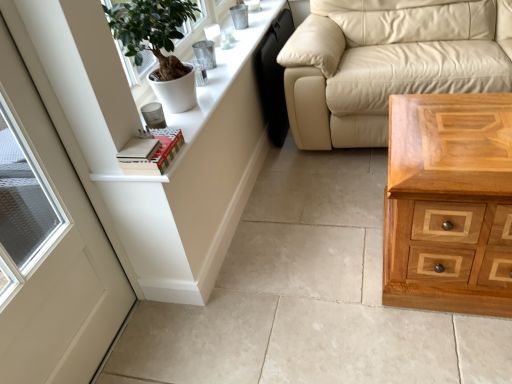
Question: Does light brown wood chest of drawers at lower right have a greater width compared to white matte door at left?

Choices:
 (A) yes
 (B) no

Answer: (A)

Question: Considering the relative sizes of light brown wood chest of drawers at lower right and white matte door at left in the image provided, is light brown wood chest of drawers at lower right shorter than white matte door at left?

Choices:
 (A) no
 (B) yes

Answer: (B)

Question: Is white matte door at left completely or partially inside light brown wood chest of drawers at lower right?

Choices:
 (A) no
 (B) yes

Answer: (A)

Question: Considering the relative positions of light brown wood chest of drawers at lower right and white matte door at left in the image provided, is light brown wood chest of drawers at lower right to the right of white matte door at left from the viewer's perspective?

Choices:
 (A) no
 (B) yes

Answer: (B)

Question: Is light brown wood chest of drawers at lower right positioned far away from white matte door at left?

Choices:
 (A) yes
 (B) no

Answer: (A)

Question: Does light brown wood chest of drawers at lower right have a greater height compared to white matte door at left?

Choices:
 (A) no
 (B) yes

Answer: (A)

Question: Is hardcover book at upper left aimed at light brown wood chest of drawers at lower right?

Choices:
 (A) yes
 (B) no

Answer: (B)

Question: Is hardcover book at upper left not near light brown wood chest of drawers at lower right?

Choices:
 (A) no
 (B) yes

Answer: (A)

Question: Is hardcover book at upper left to the right of light brown wood chest of drawers at lower right from the viewer's perspective?

Choices:
 (A) yes
 (B) no

Answer: (B)

Question: From a real-world perspective, does hardcover book at upper left stand above light brown wood chest of drawers at lower right?

Choices:
 (A) yes
 (B) no

Answer: (A)

Question: Is the surface of hardcover book at upper left in direct contact with light brown wood chest of drawers at lower right?

Choices:
 (A) yes
 (B) no

Answer: (B)

Question: Is hardcover book at upper left smaller than light brown wood chest of drawers at lower right?

Choices:
 (A) yes
 (B) no

Answer: (A)

Question: Can you confirm if white wood dresser at upper left is positioned to the right of white matte door at left?

Choices:
 (A) no
 (B) yes

Answer: (B)